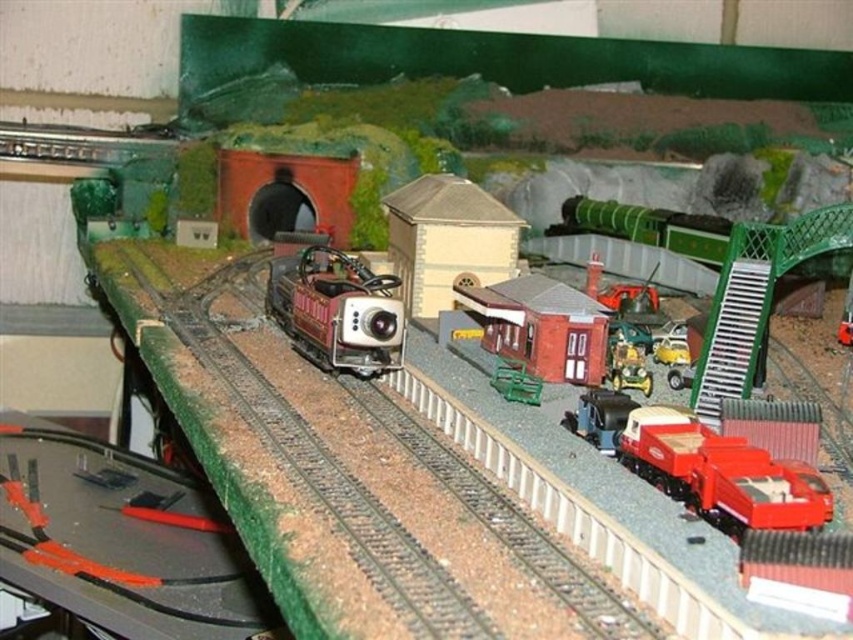
Find the location of `shiny red train car at center`. shiny red train car at center is located at coordinates click(x=337, y=310).

Does shiny red train car at center appear over metallic yellow truck at center-right?

Indeed, shiny red train car at center is positioned over metallic yellow truck at center-right.

Between point (380, 312) and point (627, 365), which one is positioned in front?

Point (380, 312) is in front.

Where is `shiny red train car at center`? Image resolution: width=853 pixels, height=640 pixels. shiny red train car at center is located at coordinates (337, 310).

Is metallic red truck at lower right taller than shiny red train car at center?

Incorrect, metallic red truck at lower right's height is not larger of shiny red train car at center's.

Is metallic red truck at lower right wider than shiny red train car at center?

No.

This screenshot has width=853, height=640. Find the location of `metallic red truck at lower right`. metallic red truck at lower right is located at coordinates (701, 465).

Between metallic yellow truck at center-right and green plastic bench at center, which one appears on the left side from the viewer's perspective?

green plastic bench at center

Who is more forward, (647,394) or (500,364)?

Positioned in front is point (647,394).

Who is more forward, (625, 368) or (538, 400)?

Point (538, 400) is more forward.

Where is `metallic yellow truck at center-right`? The width and height of the screenshot is (853, 640). metallic yellow truck at center-right is located at coordinates (627, 365).